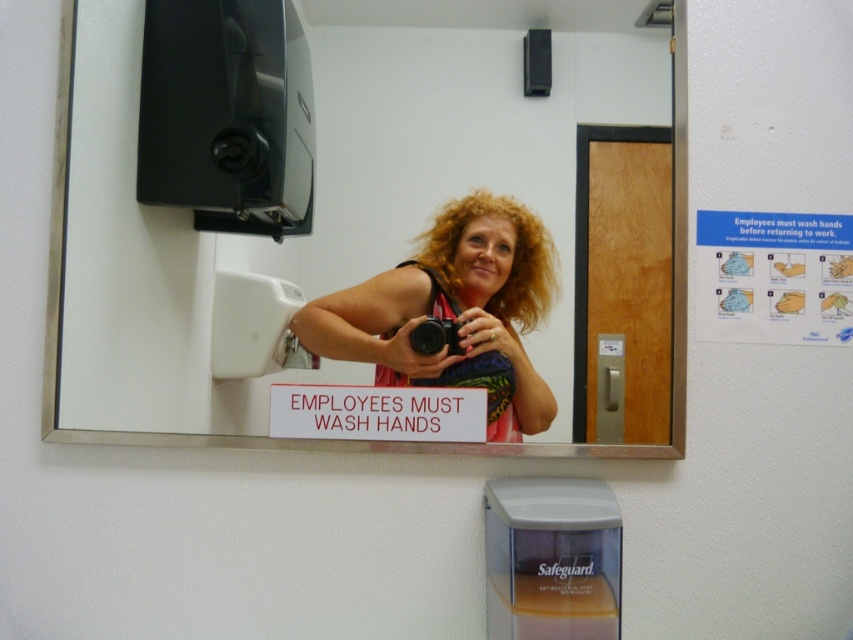
Question: From the image, what is the correct spatial relationship of multicolored fabric at center in relation to black plastic camera at center?

Choices:
 (A) right
 (B) left

Answer: (B)

Question: Among these objects, which one is nearest to the camera?

Choices:
 (A) multicolored fabric at center
 (B) white plastic sign at center

Answer: (B)

Question: Which of the following is the closest to the observer?

Choices:
 (A) (271, 397)
 (B) (508, 108)
 (C) (419, 323)
 (D) (402, 324)

Answer: (A)

Question: Which of the following is the farthest from the observer?

Choices:
 (A) multicolored fabric at center
 (B) white plastic sign at center

Answer: (A)

Question: Can you confirm if white glossy mirror at upper center is wider than black plastic camera at center?

Choices:
 (A) no
 (B) yes

Answer: (B)

Question: Can you confirm if white plastic sign at center is positioned below black plastic camera at center?

Choices:
 (A) yes
 (B) no

Answer: (A)